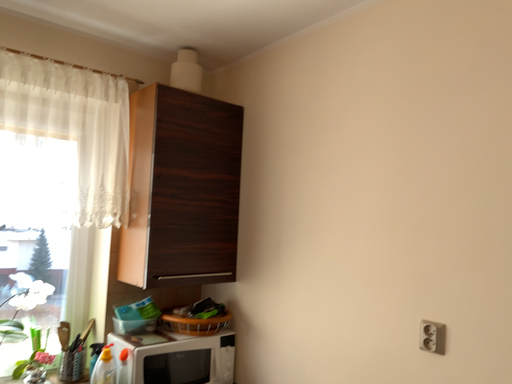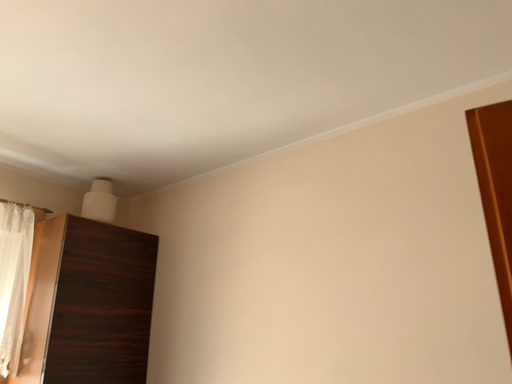
Question: How did the camera likely rotate when shooting the video?

Choices:
 (A) rotated downward
 (B) rotated upward

Answer: (B)